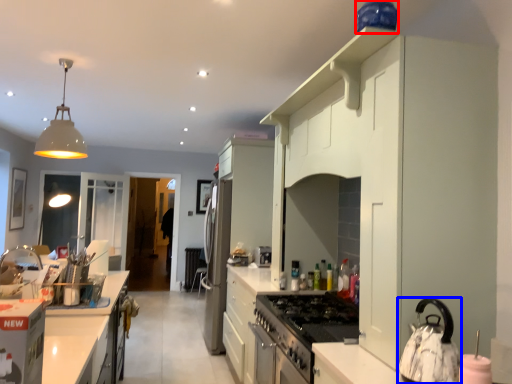
Question: Which point is closer to the camera, appliance (highlighted by a red box) or kitchen appliance (highlighted by a blue box)?

Choices:
 (A) appliance
 (B) kitchen appliance

Answer: (B)